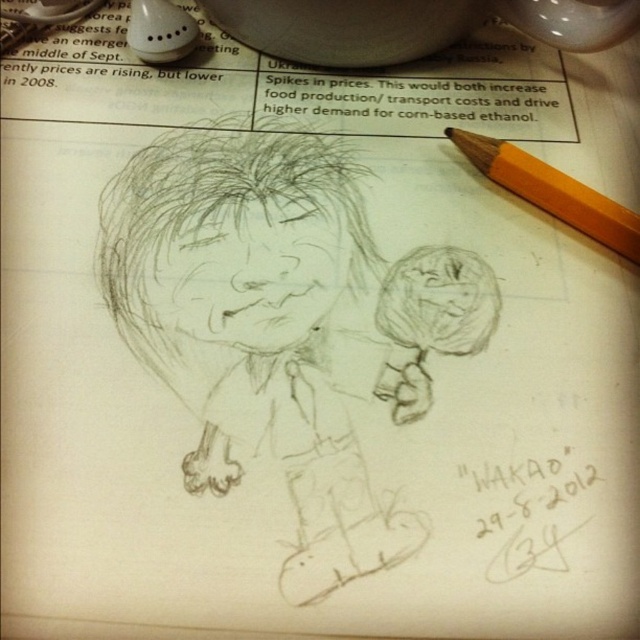
You are standing 1.19 meters away from the point at coordinates point (324,291). If you walk forward 0.5 meters, will you be closer to the point?

Yes, because you are currently 1.19 meters away from the point at coordinates point (324,291). Walking forward 0.5 meters reduces the distance to 0.69 meters, which is closer.

You are looking at the pencil sketch of the child figure on the notebook paper. There are two points marked on the paper at coordinates point [369,365] and point [568,184]. From your perspective, which point is closer to you?

Point [369,365] is in front of point [568,184], so it is closer to you.

You are an art teacher observing a student drawing. You notice the graphite sketch at center and the yellow wood pencil at upper right. Which object is taller?

The graphite sketch at center is taller than the yellow wood pencil at upper right.